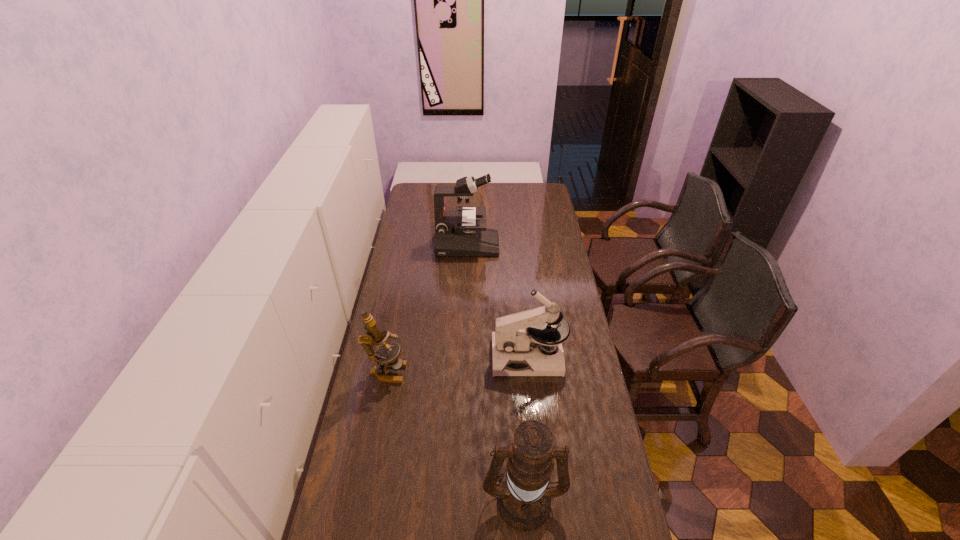
Identify which microscope is the nearest to the farthest microscope. Please provide its 2D coordinates. Your answer should be formatted as a tuple, i.e. [(x, y)], where the tuple contains the x and y coordinates of a point satisfying the conditions above.

[(518, 338)]

The image size is (960, 540). In order to click on the closest microscope to the farthest microscope in this screenshot , I will do `click(518, 338)`.

Where is `free point that satisfies the following two spatial constraints: 1. through the eyepieces of the farthest object; 2. on the right side of the oil lamp`? This screenshot has width=960, height=540. free point that satisfies the following two spatial constraints: 1. through the eyepieces of the farthest object; 2. on the right side of the oil lamp is located at coordinates point(458,499).

Find the location of a particular element. This screenshot has height=540, width=960. free region that satisfies the following two spatial constraints: 1. on the back side of the oil lamp; 2. through the eyepieces of the farthest microscope is located at coordinates (506, 245).

Identify the location of vacant region that satisfies the following two spatial constraints: 1. through the eyepieces of the oil lamp; 2. on the right side of the farthest object. (458, 499).

Locate an element on the screen. vacant point that satisfies the following two spatial constraints: 1. through the eyepieces of the farthest microscope; 2. on the back side of the oil lamp is located at coordinates (458, 499).

Identify the location of vacant space that satisfies the following two spatial constraints: 1. through the eyepieces of the oil lamp; 2. on the left side of the farthest microscope. This screenshot has height=540, width=960. (458, 499).

Find the location of `blank area in the image that satisfies the following two spatial constraints: 1. on the front side of the oil lamp; 2. on the right side of the leftmost object`. blank area in the image that satisfies the following two spatial constraints: 1. on the front side of the oil lamp; 2. on the right side of the leftmost object is located at coordinates (362, 499).